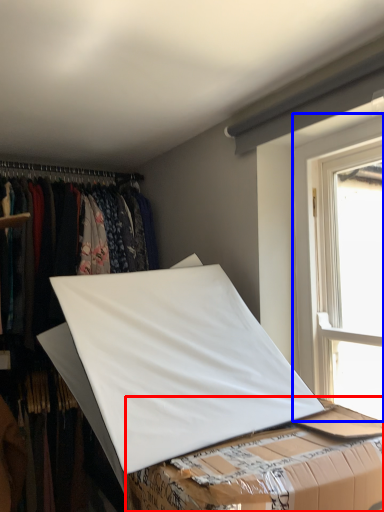
Question: Which object is closer to the camera taking this photo, table (highlighted by a red box) or window (highlighted by a blue box)?

Choices:
 (A) table
 (B) window

Answer: (A)